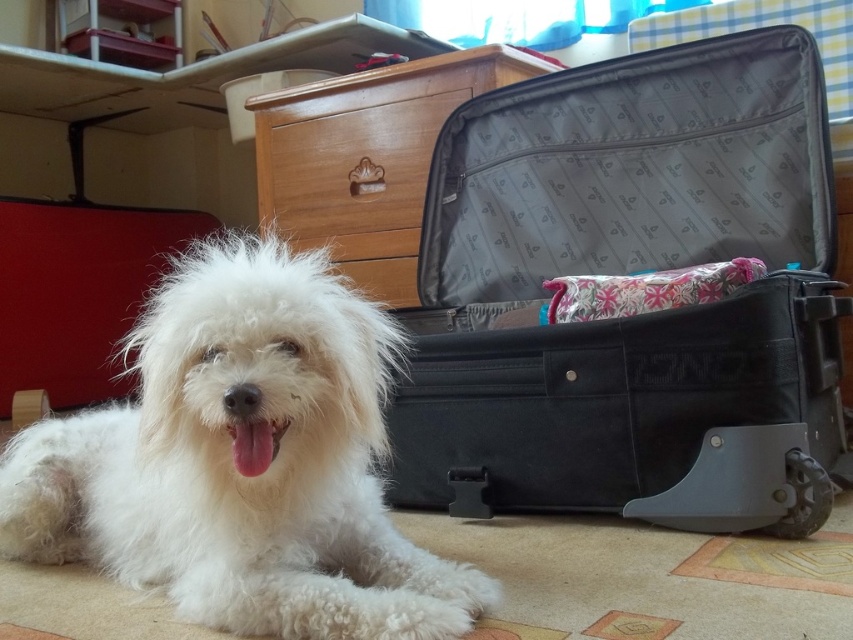
Question: Is white fluffy dog at lower left in front of wooden drawer at center?

Choices:
 (A) yes
 (B) no

Answer: (A)

Question: Which object is the closest to the white fluffy dog at lower left?

Choices:
 (A) wooden drawer at center
 (B) black fabric suitcase at center

Answer: (B)

Question: Based on their relative distances, which object is nearer to the black fabric suitcase at center?

Choices:
 (A) white fluffy dog at lower left
 (B) wooden drawer at center

Answer: (B)

Question: Where is black fabric suitcase at center located in relation to wooden drawer at center in the image?

Choices:
 (A) left
 (B) right

Answer: (B)

Question: Considering the real-world distances, which object is farthest from the white fluffy dog at lower left?

Choices:
 (A) wooden drawer at center
 (B) black fabric suitcase at center

Answer: (A)

Question: Does white fluffy dog at lower left appear on the right side of wooden drawer at center?

Choices:
 (A) yes
 (B) no

Answer: (B)